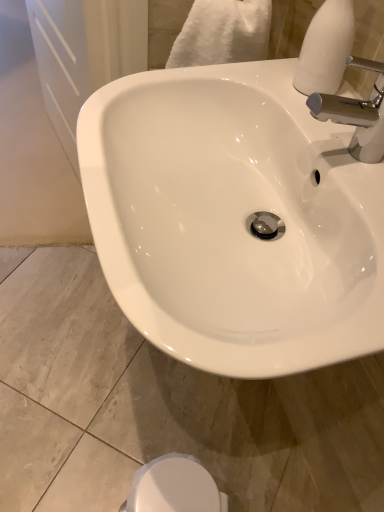
Question: From the image's perspective, is chrome metallic faucet at upper right over white glossy sink at center?

Choices:
 (A) no
 (B) yes

Answer: (B)

Question: Is chrome metallic faucet at upper right outside of white glossy sink at center?

Choices:
 (A) yes
 (B) no

Answer: (A)

Question: Is chrome metallic faucet at upper right facing towards white glossy sink at center?

Choices:
 (A) yes
 (B) no

Answer: (B)

Question: Are chrome metallic faucet at upper right and white glossy sink at center far apart?

Choices:
 (A) yes
 (B) no

Answer: (B)

Question: Is chrome metallic faucet at upper right wider than white glossy sink at center?

Choices:
 (A) no
 (B) yes

Answer: (A)

Question: Is chrome metallic faucet at upper right closer to the viewer compared to white glossy sink at center?

Choices:
 (A) no
 (B) yes

Answer: (A)

Question: Is white glossy bidet at lower center surrounded by chrome metallic faucet at upper right?

Choices:
 (A) no
 (B) yes

Answer: (A)

Question: Can we say chrome metallic faucet at upper right lies outside white glossy bidet at lower center?

Choices:
 (A) yes
 (B) no

Answer: (A)

Question: Is chrome metallic faucet at upper right closer to the viewer compared to white glossy bidet at lower center?

Choices:
 (A) yes
 (B) no

Answer: (A)

Question: Can you confirm if chrome metallic faucet at upper right is smaller than white glossy bidet at lower center?

Choices:
 (A) no
 (B) yes

Answer: (B)

Question: From a real-world perspective, is chrome metallic faucet at upper right below white glossy bidet at lower center?

Choices:
 (A) no
 (B) yes

Answer: (A)

Question: Are chrome metallic faucet at upper right and white glossy bidet at lower center far apart?

Choices:
 (A) no
 (B) yes

Answer: (A)

Question: Is white matte soap dispenser at upper right thinner than white glossy bidet at lower center?

Choices:
 (A) no
 (B) yes

Answer: (B)